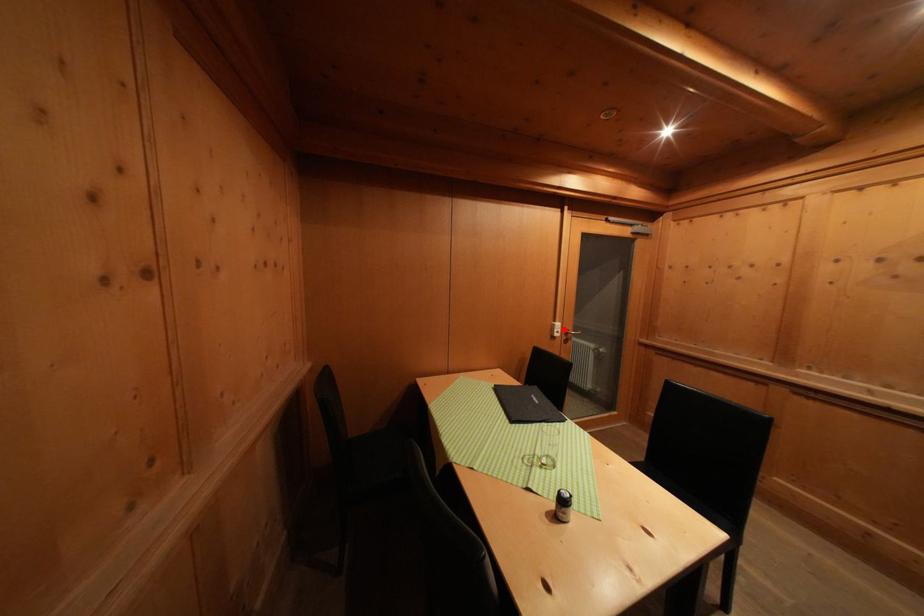
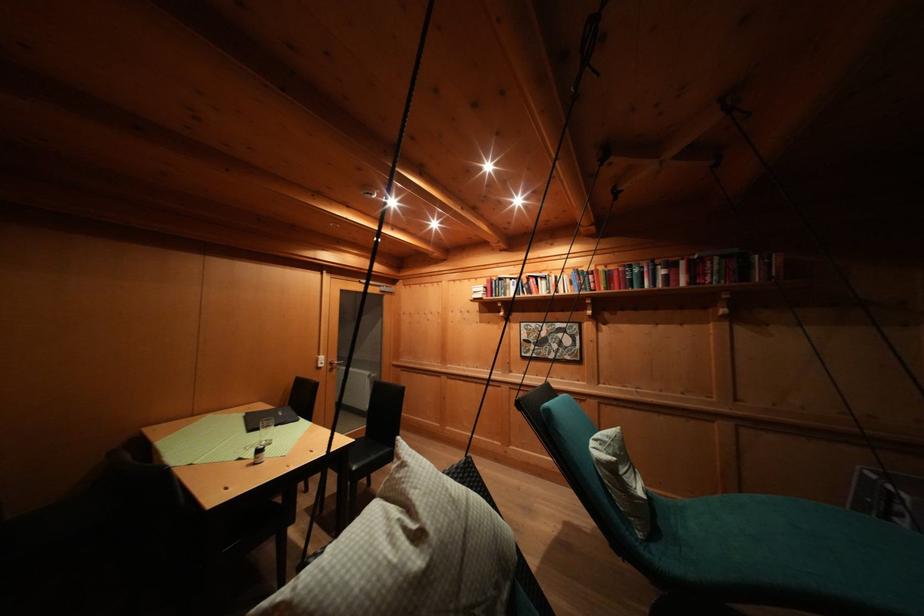
Find the pixel in the second image that matches the highlighted location in the first image.

(327, 362)